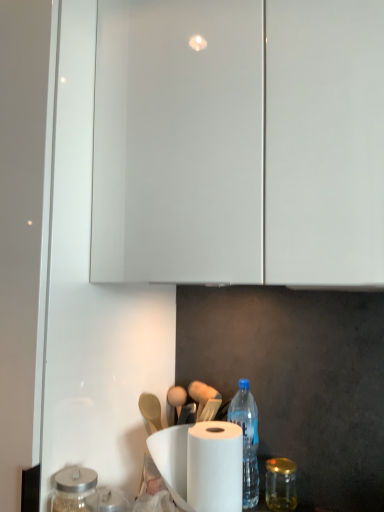
Question: Can you confirm if blue plastic bottle at lower center is smaller than gold metallic jar at lower right, which ranks as the first glass jar in right-to-left order?

Choices:
 (A) yes
 (B) no

Answer: (B)

Question: Does blue plastic bottle at lower center have a lesser width compared to gold metallic jar at lower right, which ranks as the first glass jar in back-to-front order?

Choices:
 (A) no
 (B) yes

Answer: (A)

Question: Is blue plastic bottle at lower center taller than gold metallic jar at lower right, which ranks as the first glass jar in right-to-left order?

Choices:
 (A) no
 (B) yes

Answer: (B)

Question: Can you confirm if blue plastic bottle at lower center is shorter than gold metallic jar at lower right, positioned as the 2th glass jar in left-to-right order?

Choices:
 (A) yes
 (B) no

Answer: (B)

Question: From the image's perspective, is blue plastic bottle at lower center on gold metallic jar at lower right, which ranks as the first glass jar in right-to-left order?

Choices:
 (A) yes
 (B) no

Answer: (A)

Question: Is gold metallic jar at lower right, which ranks as the first glass jar in right-to-left order, in front of or behind transparent glass jar at lower left, which ranks as the second glass jar in back-to-front order, in the image?

Choices:
 (A) behind
 (B) front

Answer: (A)

Question: In terms of width, does gold metallic jar at lower right, which ranks as the first glass jar in right-to-left order, look wider or thinner when compared to transparent glass jar at lower left, marked as the first glass jar in a left-to-right arrangement?

Choices:
 (A) wide
 (B) thin

Answer: (B)

Question: In terms of size, does gold metallic jar at lower right, which ranks as the first glass jar in back-to-front order, appear bigger or smaller than transparent glass jar at lower left, which ranks as the second glass jar in back-to-front order?

Choices:
 (A) small
 (B) big

Answer: (A)

Question: From a real-world perspective, is gold metallic jar at lower right, which ranks as the first glass jar in back-to-front order, above or below transparent glass jar at lower left, which ranks as the second glass jar in back-to-front order?

Choices:
 (A) below
 (B) above

Answer: (A)

Question: Is blue plastic bottle at lower center taller or shorter than transparent glass jar at lower left, arranged as the 2th glass jar when viewed from the right?

Choices:
 (A) short
 (B) tall

Answer: (B)

Question: From the image's perspective, relative to transparent glass jar at lower left, the first glass jar in the front-to-back sequence, is blue plastic bottle at lower center above or below?

Choices:
 (A) below
 (B) above

Answer: (B)

Question: Relative to transparent glass jar at lower left, which ranks as the second glass jar in back-to-front order, is blue plastic bottle at lower center in front or behind?

Choices:
 (A) behind
 (B) front

Answer: (A)

Question: Does point (256, 500) appear closer or farther from the camera than point (84, 482)?

Choices:
 (A) closer
 (B) farther

Answer: (B)

Question: Looking at their shapes, would you say transparent glass jar at lower left, marked as the first glass jar in a left-to-right arrangement, is wider or thinner than gold metallic jar at lower right, positioned as the 2th glass jar in left-to-right order?

Choices:
 (A) thin
 (B) wide

Answer: (B)

Question: From the image's perspective, is transparent glass jar at lower left, the first glass jar in the front-to-back sequence, above or below gold metallic jar at lower right, positioned as the 2th glass jar in left-to-right order?

Choices:
 (A) below
 (B) above

Answer: (B)